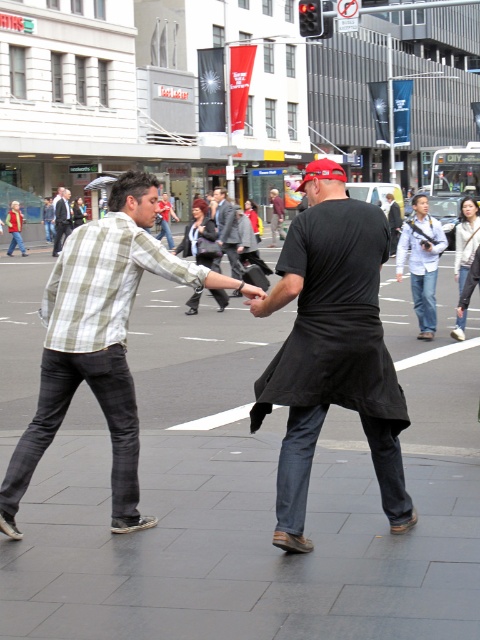
Question: Which is nearer to the black asphalt at center?

Choices:
 (A) checkered fabric shirt at left
 (B) matte black suit at left
 (C) black cotton shirt at center

Answer: (A)

Question: Which of the following is the closest to the observer?

Choices:
 (A) matte black suit at left
 (B) checkered fabric shirt at left

Answer: (B)

Question: Which point is closer to the camera?

Choices:
 (A) (99, 218)
 (B) (290, 572)
 (C) (236, 216)

Answer: (B)

Question: In this image, where is black matte shirt at center located relative to matte black suit at left?

Choices:
 (A) above
 (B) below

Answer: (B)

Question: Can you confirm if black cotton shirt at center is positioned to the right of matte black suit at left?

Choices:
 (A) no
 (B) yes

Answer: (B)

Question: Is checkered fabric shirt at left to the left of black cotton shirt at center from the viewer's perspective?

Choices:
 (A) yes
 (B) no

Answer: (B)